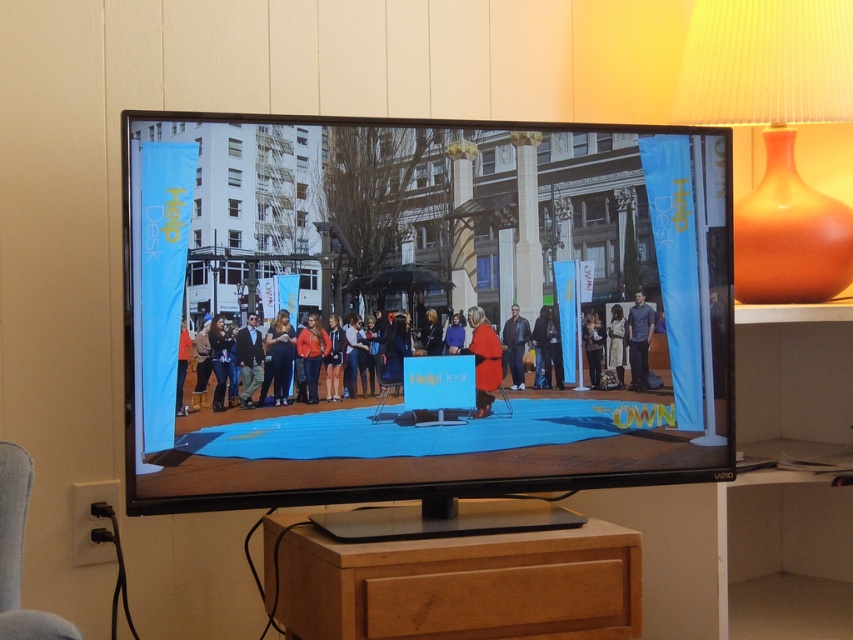
Question: Can you confirm if wooden drawer at lower center is positioned below matte black podium at center?

Choices:
 (A) no
 (B) yes

Answer: (B)

Question: Is gray fabric chair at lower left below red matte coat at center?

Choices:
 (A) no
 (B) yes

Answer: (B)

Question: Does dark gray suit at center lie behind matte orange jacket at center?

Choices:
 (A) no
 (B) yes

Answer: (A)

Question: Which point is farther from the camera taking this photo?

Choices:
 (A) (592, 330)
 (B) (242, 372)
 (C) (279, 186)
 (D) (374, 627)

Answer: (A)

Question: Among these points, which one is farthest from the camera?

Choices:
 (A) (270, 525)
 (B) (218, 316)
 (C) (474, 598)

Answer: (A)

Question: Which of the following is the closest to the observer?

Choices:
 (A) dark blue jeans at center
 (B) orange matte vase at right
 (C) dark gray suit at center

Answer: (C)